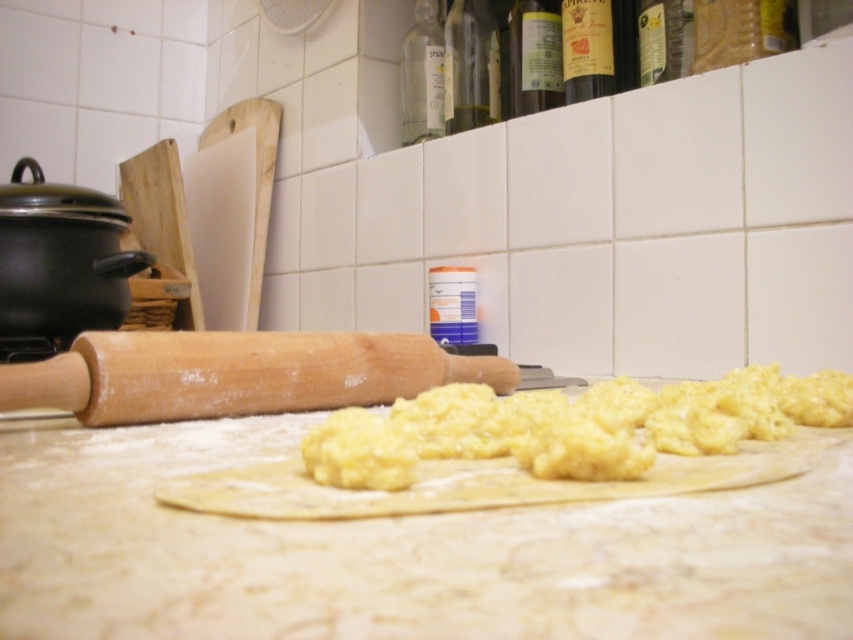
Question: Which point is farther to the camera?

Choices:
 (A) transparent glass bottle at upper center
 (B) wooden rolling pin at center

Answer: (A)

Question: Which of the following is the closest to the observer?

Choices:
 (A) (519, 10)
 (B) (489, 33)
 (C) (438, 17)
 (D) (598, 44)

Answer: (D)

Question: Is yellow dough at center positioned in front of transparent plastic bottle at upper center?

Choices:
 (A) no
 (B) yes

Answer: (B)

Question: Does translucent glass bottle at upper center have a greater width compared to transparent glass bottle at upper center?

Choices:
 (A) no
 (B) yes

Answer: (A)

Question: Is wooden rolling pin at center in front of transparent glass bottle at upper center?

Choices:
 (A) yes
 (B) no

Answer: (A)

Question: Which object is farther from the camera taking this photo?

Choices:
 (A) wooden rolling pin at center
 (B) transparent glass bottle at upper center

Answer: (B)